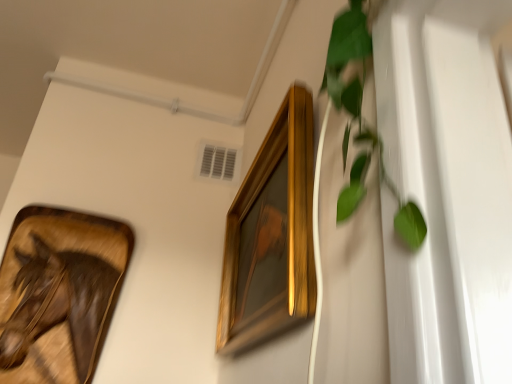
Question: From the image's perspective, is green leafy plant at right located beneath gold wooden picture frame at upper center, arranged as the first picture frame when viewed from the right?

Choices:
 (A) yes
 (B) no

Answer: (B)

Question: Considering the relative sizes of green leafy plant at right and gold wooden picture frame at upper center, arranged as the first picture frame when viewed from the right, in the image provided, is green leafy plant at right smaller than gold wooden picture frame at upper center, arranged as the first picture frame when viewed from the right,?

Choices:
 (A) yes
 (B) no

Answer: (A)

Question: Would you say green leafy plant at right is outside gold wooden picture frame at upper center, arranged as the first picture frame when viewed from the right?

Choices:
 (A) no
 (B) yes

Answer: (B)

Question: Considering the relative sizes of green leafy plant at right and gold wooden picture frame at upper center, arranged as the first picture frame when viewed from the right, in the image provided, is green leafy plant at right shorter than gold wooden picture frame at upper center, arranged as the first picture frame when viewed from the right,?

Choices:
 (A) yes
 (B) no

Answer: (A)

Question: Is the position of green leafy plant at right more distant than that of gold wooden picture frame at upper center, arranged as the first picture frame when viewed from the right?

Choices:
 (A) no
 (B) yes

Answer: (A)

Question: Does green leafy plant at right come in front of gold wooden picture frame at upper center, the second picture frame positioned from the left?

Choices:
 (A) no
 (B) yes

Answer: (B)

Question: Considering the relative sizes of gold wooden picture frame at upper center, the second picture frame positioned from the left, and green leafy plant at right in the image provided, is gold wooden picture frame at upper center, the second picture frame positioned from the left, wider than green leafy plant at right?

Choices:
 (A) no
 (B) yes

Answer: (B)

Question: From a real-world perspective, is gold wooden picture frame at upper center, the second picture frame positioned from the left, on top of green leafy plant at right?

Choices:
 (A) no
 (B) yes

Answer: (A)

Question: Does gold wooden picture frame at upper center, the second picture frame positioned from the left, have a smaller size compared to green leafy plant at right?

Choices:
 (A) no
 (B) yes

Answer: (A)

Question: Is gold wooden picture frame at upper center, arranged as the first picture frame when viewed from the right, thinner than green leafy plant at right?

Choices:
 (A) no
 (B) yes

Answer: (A)

Question: Is gold wooden picture frame at upper center, the second picture frame positioned from the left, turned away from green leafy plant at right?

Choices:
 (A) no
 (B) yes

Answer: (A)

Question: Does gold wooden picture frame at upper center, the second picture frame positioned from the left, have a greater height compared to green leafy plant at right?

Choices:
 (A) yes
 (B) no

Answer: (A)

Question: Is wooden frame at left, positioned as the 2th picture frame in right-to-left order, shorter than green leafy plant at right?

Choices:
 (A) yes
 (B) no

Answer: (B)